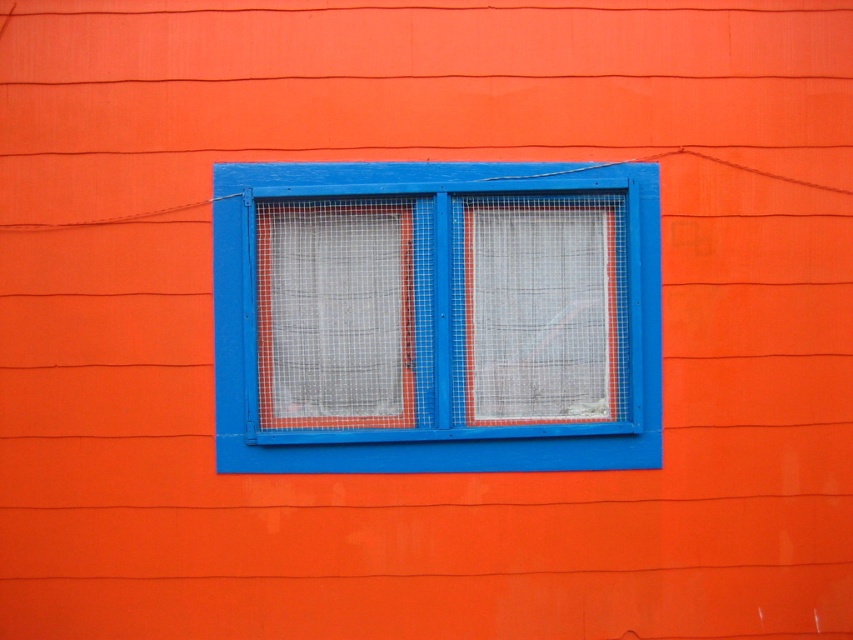
You are standing in front of an orange wall with a blue window. Where is the blue painted wood window at center located in the image?

The blue painted wood window at center is located at point (436, 317).

You are standing in front of the orange wall and want to touch the metal mesh screen at center. Based on the coordinates provided, can you determine if the point marked at (335, 314) is located on the metal mesh screen at center?

Yes, the point marked at (335, 314) is located on the metal mesh screen at center as it is explicitly stated in the description that this point marks the metal mesh screen at center.

You are a painter who wants to hang a decorative tapestry between the blue painted wood window at center and the white mesh screen at center. Which object should you place the tapestry closer to if you want it to be centered in the middle of the wall?

The blue painted wood window at center is wider than the white mesh screen at center, so to center the tapestry, place it closer to the white mesh screen at center to balance the width difference.